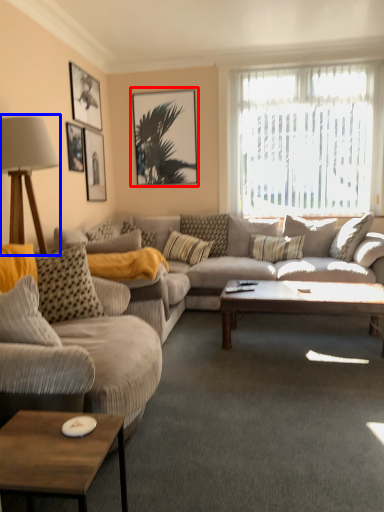
Question: Among these objects, which one is nearest to the camera, picture frame (highlighted by a red box) or table lamp (highlighted by a blue box)?

Choices:
 (A) picture frame
 (B) table lamp

Answer: (B)